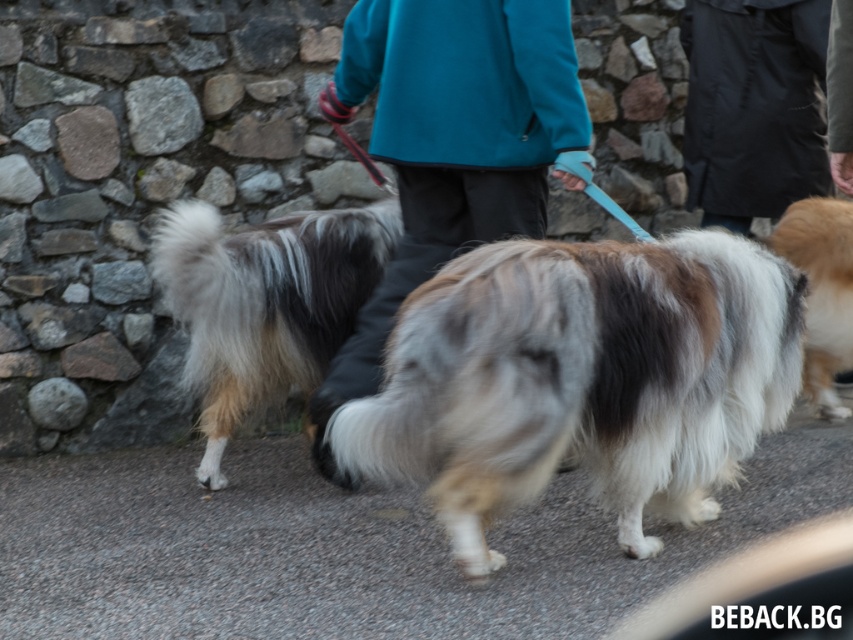
Question: Which is farther from the black waterproof jacket at upper right?

Choices:
 (A) fluffy beige dog at right
 (B) fluffy multi-colored dog at center

Answer: (B)

Question: Which object appears farthest from the camera in this image?

Choices:
 (A) black waterproof jacket at upper right
 (B) fuzzy white dog at center
 (C) fluffy multi-colored dog at center
 (D) fluffy beige dog at right

Answer: (A)

Question: Does fuzzy white dog at center have a smaller size compared to fluffy beige dog at right?

Choices:
 (A) yes
 (B) no

Answer: (B)

Question: Is teal fleece jacket at center thinner than black waterproof jacket at upper right?

Choices:
 (A) no
 (B) yes

Answer: (A)

Question: Does fluffy multi-colored dog at center lie in front of fluffy beige dog at right?

Choices:
 (A) yes
 (B) no

Answer: (A)

Question: Which object is farther from the camera taking this photo?

Choices:
 (A) fluffy beige dog at right
 (B) black waterproof jacket at upper right

Answer: (B)